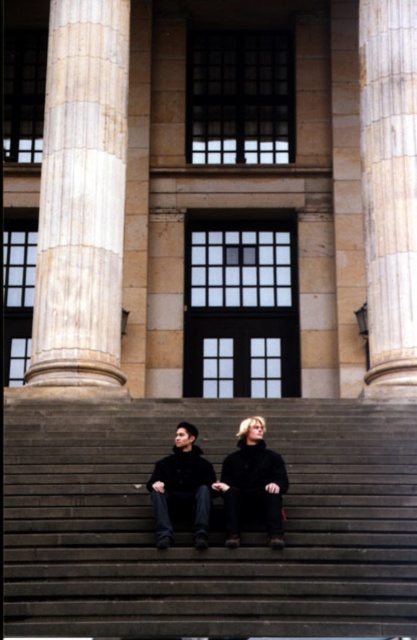
You are a visitor at the entrance of the grand building and notice the marble column at right and the dark brown leather jacket at center. Which object takes up more space in the scene?

The marble column at right is larger in size than the dark brown leather jacket at center, so it takes up more space in the scene.

You are standing at the bottom of the stone steps leading to the grand building and notice both the marble column at right and the black woolen coat at center. Which object is higher up the steps?

The marble column at right is positioned over the black woolen coat at center, meaning it is higher up the steps.

You are standing at the base of the stone steps leading to the grand building. You see two points marked on the steps. Which point is closer to you, point (376,339) or point (178,424)?

Point (376,339) is closer to you because it is further to the viewer than point (178,424).